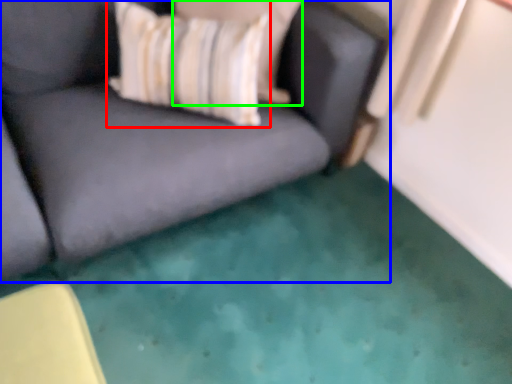
Question: Based on their relative distances, which object is nearer to throw pillow (highlighted by a red box)? Choose from studio couch (highlighted by a blue box) and pillow (highlighted by a green box).

Choices:
 (A) studio couch
 (B) pillow

Answer: (B)